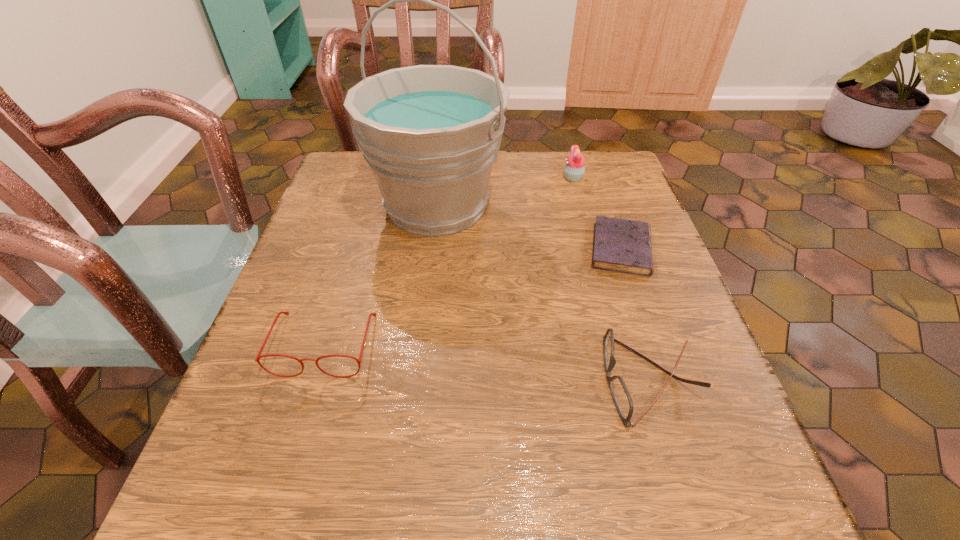
In the image, there is a desktop. Identify the location of vacant space at the near left corner. This screenshot has height=540, width=960. (291, 524).

Identify the location of vacant space at the far right corner of the desktop. The width and height of the screenshot is (960, 540). pos(605,154).

In order to click on vacant region between the bucket and the right spectacles in this screenshot , I will do `click(543, 293)`.

You are a GUI agent. You are given a task and a screenshot of the screen. Output one action in this format:
    pyautogui.click(x=<x>, y=<y>)
    Task: Click on the free space between the left spectacles and the diary
    Image resolution: width=960 pixels, height=540 pixels.
    Given the screenshot: What is the action you would take?
    pyautogui.click(x=473, y=296)

Where is `vacant point located between the tallest object and the diary`? The height and width of the screenshot is (540, 960). vacant point located between the tallest object and the diary is located at coordinates coord(529,227).

Image resolution: width=960 pixels, height=540 pixels. I want to click on free space between the shortest object and the taller spectacles, so click(x=473, y=296).

Find the location of a particular element. free area in between the right spectacles and the shortest object is located at coordinates (636, 314).

Identify the location of free space between the fourth tallest object and the left spectacles. Image resolution: width=960 pixels, height=540 pixels. (487, 362).

Identify the location of blank region between the right spectacles and the second tallest object. (612, 279).

Identify the location of unoccupied area between the right spectacles and the cupcake. The width and height of the screenshot is (960, 540). (612, 279).